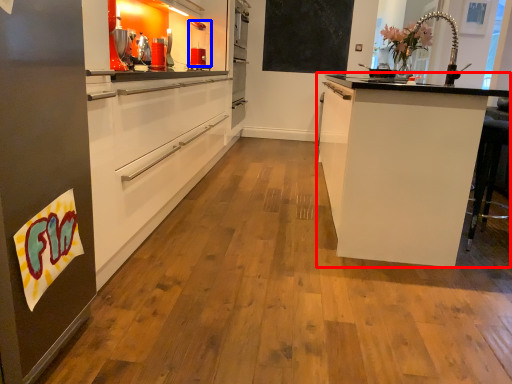
Question: Among these objects, which one is farthest to the camera, cabinetry (highlighted by a red box) or kitchen appliance (highlighted by a blue box)?

Choices:
 (A) cabinetry
 (B) kitchen appliance

Answer: (B)